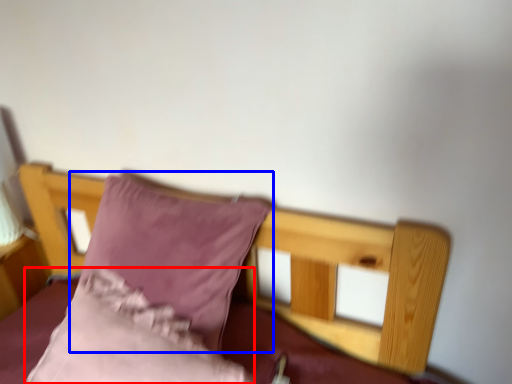
Question: Which object is further to the camera taking this photo, pillow (highlighted by a red box) or pillow (highlighted by a blue box)?

Choices:
 (A) pillow
 (B) pillow

Answer: (B)